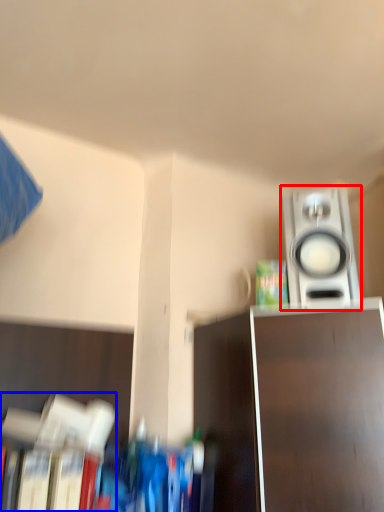
Question: Which object is closer to the camera taking this photo, home appliance (highlighted by a red box) or book (highlighted by a blue box)?

Choices:
 (A) home appliance
 (B) book

Answer: (B)